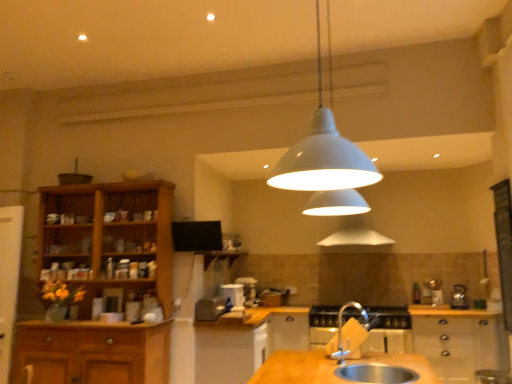
Question: Considering the relative sizes of metallic silver gas stove at center and silver metallic sink at lower center in the image provided, is metallic silver gas stove at center shorter than silver metallic sink at lower center?

Choices:
 (A) no
 (B) yes

Answer: (A)

Question: Is silver metallic sink at lower center located within metallic silver gas stove at center?

Choices:
 (A) yes
 (B) no

Answer: (B)

Question: Considering the relative sizes of metallic silver gas stove at center and silver metallic sink at lower center in the image provided, is metallic silver gas stove at center wider than silver metallic sink at lower center?

Choices:
 (A) no
 (B) yes

Answer: (B)

Question: Does metallic silver gas stove at center have a larger size compared to silver metallic sink at lower center?

Choices:
 (A) no
 (B) yes

Answer: (B)

Question: Is metallic silver gas stove at center smaller than silver metallic sink at lower center?

Choices:
 (A) yes
 (B) no

Answer: (B)

Question: Is metallic silver gas stove at center looking in the opposite direction of silver metallic sink at lower center?

Choices:
 (A) yes
 (B) no

Answer: (B)

Question: Considering the relative sizes of silver metallic tap at lower center and silver metallic sink at lower center in the image provided, is silver metallic tap at lower center taller than silver metallic sink at lower center?

Choices:
 (A) yes
 (B) no

Answer: (A)

Question: Is silver metallic tap at lower center aimed at silver metallic sink at lower center?

Choices:
 (A) yes
 (B) no

Answer: (B)

Question: Does silver metallic tap at lower center appear on the right side of silver metallic sink at lower center?

Choices:
 (A) yes
 (B) no

Answer: (B)

Question: Is silver metallic tap at lower center outside silver metallic sink at lower center?

Choices:
 (A) no
 (B) yes

Answer: (B)

Question: Is silver metallic tap at lower center thinner than silver metallic sink at lower center?

Choices:
 (A) yes
 (B) no

Answer: (A)

Question: From a real-world perspective, is silver metallic tap at lower center positioned over silver metallic sink at lower center based on gravity?

Choices:
 (A) no
 (B) yes

Answer: (B)

Question: Can you confirm if white glossy coffee cup at center, placed as the 3th appliance when sorted from left to right, is smaller than white matte pendant light at center?

Choices:
 (A) no
 (B) yes

Answer: (B)